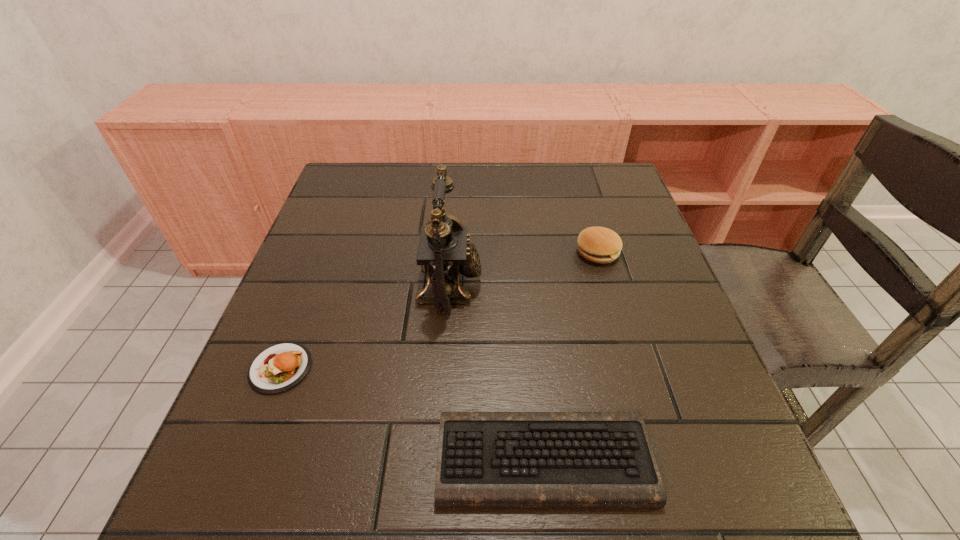
In the image, there is a desktop. Where is `vacant space at the far right corner`? This screenshot has height=540, width=960. vacant space at the far right corner is located at coordinates (620, 192).

Locate an element on the screen. This screenshot has height=540, width=960. vacant space at the near right corner of the desktop is located at coordinates (665, 474).

At what (x,y) coordinates should I click in order to perform the action: click on vacant region between the tallest object and the second nearest object. Please return your answer as a coordinate pair (x, y). The image size is (960, 540). Looking at the image, I should click on [365, 326].

Where is `unoccupied area between the nearest object and the nearer patty (food)`? This screenshot has height=540, width=960. unoccupied area between the nearest object and the nearer patty (food) is located at coordinates (412, 414).

Where is `vacant point located between the nearest object and the tallest object`? This screenshot has height=540, width=960. vacant point located between the nearest object and the tallest object is located at coordinates (497, 372).

This screenshot has height=540, width=960. Identify the location of free spot between the leftmost object and the tallest object. (365, 326).

Find the location of `unoccupied position between the left patty (food) and the computer keyboard`. unoccupied position between the left patty (food) and the computer keyboard is located at coordinates (412, 414).

Where is `free spot between the computer keyboard and the left patty (food)`? The height and width of the screenshot is (540, 960). free spot between the computer keyboard and the left patty (food) is located at coordinates (412, 414).

Locate an element on the screen. The height and width of the screenshot is (540, 960). vacant point located between the second tallest object and the computer keyboard is located at coordinates (570, 355).

The width and height of the screenshot is (960, 540). I want to click on unoccupied position between the nearest object and the farther patty (food), so click(x=570, y=355).